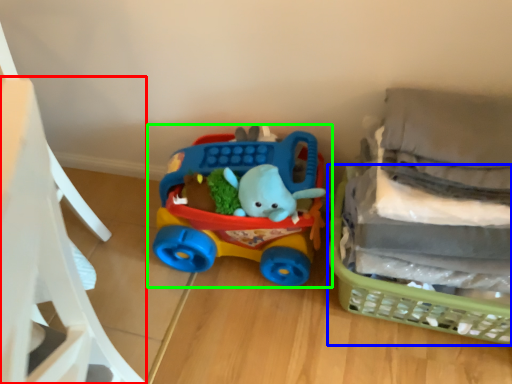
Question: Based on their relative distances, which object is farther from chair (highlighted by a red box)? Choose from basket (highlighted by a blue box) and toy (highlighted by a green box).

Choices:
 (A) basket
 (B) toy

Answer: (A)